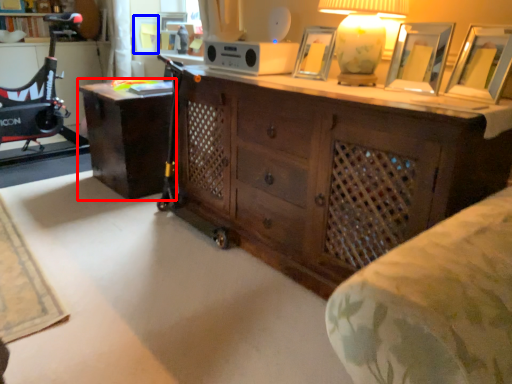
Question: Among these objects, which one is farthest to the camera, desk (highlighted by a red box) or picture frame (highlighted by a blue box)?

Choices:
 (A) desk
 (B) picture frame

Answer: (B)